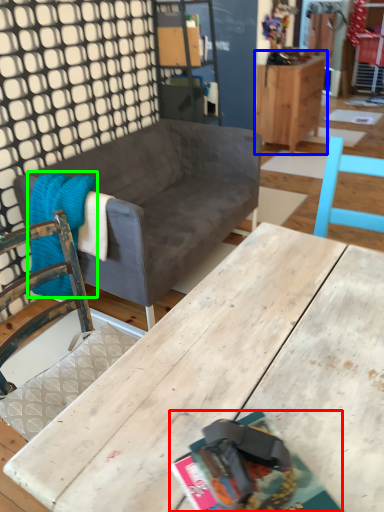
Question: Based on their relative distances, which object is nearer to magazine (highlighted by a red box)? Choose from cabinetry (highlighted by a blue box) and blanket (highlighted by a green box).

Choices:
 (A) cabinetry
 (B) blanket

Answer: (B)